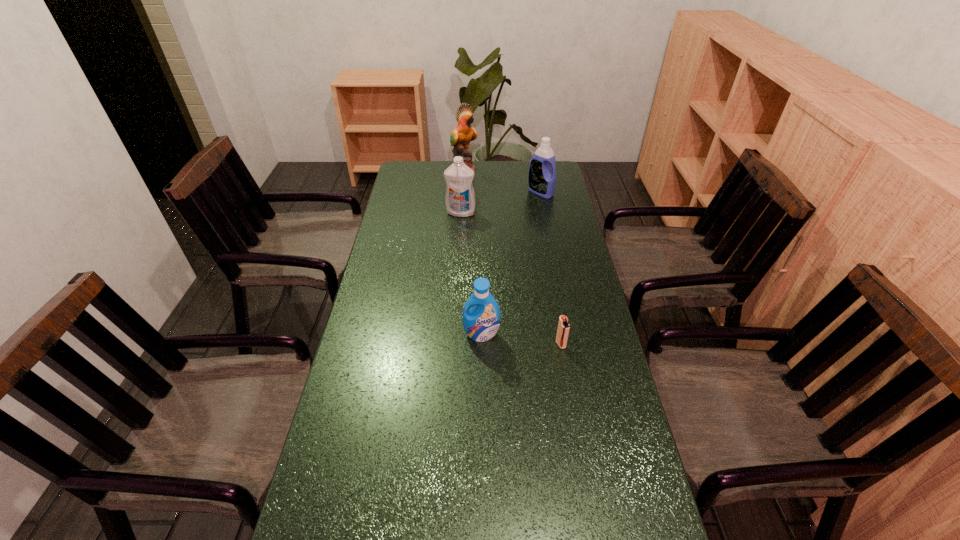
Identify which object is the second closest to the third farthest object. Please provide its 2D coordinates. Your answer should be formatted as a tuple, i.e. [(x, y)], where the tuple contains the x and y coordinates of a point satisfying the conditions above.

[(463, 133)]

Where is `object that is the fourth closest to the second farthest detergent`? object that is the fourth closest to the second farthest detergent is located at coordinates [x=563, y=328].

Locate which detergent is the second closest to the tallest object. Please provide its 2D coordinates. Your answer should be formatted as a tuple, i.e. [(x, y)], where the tuple contains the x and y coordinates of a point satisfying the conditions above.

[(460, 200)]

Locate an element on the screen. The image size is (960, 540). detergent that is the second closest to the farthest object is located at coordinates (460, 200).

Locate an element on the screen. free space that satisfies the following two spatial constraints: 1. on the back side of the igniter; 2. on the front-facing side of the tallest object is located at coordinates [x=531, y=170].

Where is `vacant space that satisfies the following two spatial constraints: 1. on the front-facing side of the tallest object; 2. on the front side of the third farthest object`? This screenshot has width=960, height=540. vacant space that satisfies the following two spatial constraints: 1. on the front-facing side of the tallest object; 2. on the front side of the third farthest object is located at coordinates (462, 212).

Where is `free space that satisfies the following two spatial constraints: 1. on the front side of the third farthest object; 2. on the right side of the shortest object`? free space that satisfies the following two spatial constraints: 1. on the front side of the third farthest object; 2. on the right side of the shortest object is located at coordinates (453, 345).

Locate an element on the screen. The height and width of the screenshot is (540, 960). free space in the image that satisfies the following two spatial constraints: 1. on the back side of the shortest object; 2. on the front-facing side of the parrot is located at coordinates [x=531, y=170].

This screenshot has width=960, height=540. What are the coordinates of `free space that satisfies the following two spatial constraints: 1. on the front side of the igniter; 2. on the left side of the second farthest detergent` in the screenshot? It's located at [x=453, y=345].

Where is `vacant region that satisfies the following two spatial constraints: 1. on the front-facing side of the farthest object; 2. on the front side of the second farthest detergent`? vacant region that satisfies the following two spatial constraints: 1. on the front-facing side of the farthest object; 2. on the front side of the second farthest detergent is located at coordinates (462, 212).